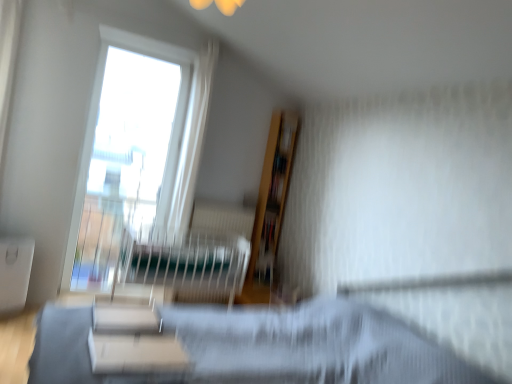
The width and height of the screenshot is (512, 384). I want to click on matte black hospital bed at center, so click(x=184, y=264).

Find the location of a particular element. The width and height of the screenshot is (512, 384). white matte table at lower center, placed as the first table when sorted from right to left is located at coordinates (136, 354).

I want to click on transparent glass window at upper left, so click(137, 150).

What are the coordinates of `white glossy bookshelf at center` in the screenshot? It's located at (124, 315).

This screenshot has width=512, height=384. I want to click on matte black hospital bed at center, so click(184, 264).

From the picture: Is white matte table at lower left, the 2th table positioned from the front, wider or thinner than transparent glass window at upper left?

Considering their sizes, white matte table at lower left, the 2th table positioned from the front, looks broader than transparent glass window at upper left.

Considering the sizes of objects white matte table at lower left, which ranks as the second table in right-to-left order, and transparent glass window at upper left in the image provided, who is bigger, white matte table at lower left, which ranks as the second table in right-to-left order, or transparent glass window at upper left?

transparent glass window at upper left is bigger.

Considering the positions of objects white matte table at lower left, positioned as the 1th table in back-to-front order, and transparent glass window at upper left in the image provided, who is more to the right, white matte table at lower left, positioned as the 1th table in back-to-front order, or transparent glass window at upper left?

transparent glass window at upper left is more to the right.

Is white matte table at lower left, positioned as the 1th table in back-to-front order, oriented towards transparent glass window at upper left?

No.

Is wooden bookshelf at upper center positioned with its back to white matte table at lower center, placed as the first table when sorted from right to left?

That's not correct — wooden bookshelf at upper center is not looking away from white matte table at lower center, placed as the first table when sorted from right to left.

In the image, is wooden bookshelf at upper center on the left side or the right side of white matte table at lower center, which is the 2th table in back-to-front order?

In the image, wooden bookshelf at upper center appears on the right side of white matte table at lower center, which is the 2th table in back-to-front order.

From a real-world perspective, count 1st tables downward from the wooden bookshelf at upper center and point to it. Please provide its 2D coordinates.

[(136, 354)]

Locate an element on the screen. The height and width of the screenshot is (384, 512). window that is on the left side of white glossy bookshelf at center is located at coordinates (137, 150).

Is transparent glass window at upper left further to camera compared to white glossy bookshelf at center?

Yes, it is.

Is transparent glass window at upper left facing towards white glossy bookshelf at center?

Yes, transparent glass window at upper left is turned towards white glossy bookshelf at center.

Would you say white matte table at lower left, positioned as the 1th table in back-to-front order, is part of matte black hospital bed at center's contents?

Definitely not — white matte table at lower left, positioned as the 1th table in back-to-front order, is not inside matte black hospital bed at center.

Is matte black hospital bed at center looking in the opposite direction of white matte table at lower left, positioned as the 1th table in back-to-front order?

No, white matte table at lower left, positioned as the 1th table in back-to-front order, is not at the back of matte black hospital bed at center.

Is matte black hospital bed at center with white matte table at lower left, positioned as the 1th table in back-to-front order?

No.

Locate an element on the screen. The height and width of the screenshot is (384, 512). book located above the white matte table at lower left, which is the first table in left-to-right order (from the image's perspective) is located at coordinates (269, 233).

From the image's perspective, between white matte table at lower left, which is the first table in left-to-right order, and wooden bookshelf at upper center, who is located below?

white matte table at lower left, which is the first table in left-to-right order.

Considering the positions of points (144, 192) and (126, 260), is point (144, 192) farther from camera compared to point (126, 260)?

Yes, it is behind point (126, 260).

In the scene shown: Is transparent glass window at upper left inside or outside of matte black hospital bed at center?

transparent glass window at upper left is outside matte black hospital bed at center.

Considering the sizes of objects transparent glass window at upper left and matte black hospital bed at center in the image provided, who is shorter, transparent glass window at upper left or matte black hospital bed at center?

Standing shorter between the two is matte black hospital bed at center.

From the image's perspective, is matte black hospital bed at center located above or below transparent glass window at upper left?

From the image's perspective, matte black hospital bed at center appears below transparent glass window at upper left.

Can you confirm if matte black hospital bed at center is positioned to the left of transparent glass window at upper left?

No, matte black hospital bed at center is not to the left of transparent glass window at upper left.

Is point (168, 250) closer or farther from the camera than point (182, 144)?

Point (168, 250) is positioned closer to the camera compared to point (182, 144).

Is matte black hospital bed at center inside the boundaries of transparent glass window at upper left, or outside?

The correct answer is: outside.

This screenshot has width=512, height=384. I want to click on window on the right of white matte table at lower left, the 2th table positioned from the front, so click(137, 150).

Find the location of `book behind the white matte table at lower center, which is the 2th table in back-to-front order`. book behind the white matte table at lower center, which is the 2th table in back-to-front order is located at coordinates (269, 233).

Which object lies nearer to the anchor point transparent glass window at upper left, white matte table at lower left, positioned as the 1th table in back-to-front order, or matte black hospital bed at center?

matte black hospital bed at center.

From the image, which object appears to be nearer to wooden bookshelf at upper center, white matte table at lower left, which is the first table in left-to-right order, or transparent glass window at upper left?

Based on the image, transparent glass window at upper left appears to be nearer to wooden bookshelf at upper center.

Considering their positions, is matte black hospital bed at center positioned closer to white matte table at lower left, the 2th table positioned from the front, than white matte table at lower center, placed as the first table when sorted from right to left?

The object closer to white matte table at lower left, the 2th table positioned from the front, is matte black hospital bed at center.

When comparing their distances from wooden bookshelf at upper center, does white matte table at lower center, which is counted as the 2th table, starting from the left, or matte black hospital bed at center seem further?

white matte table at lower center, which is counted as the 2th table, starting from the left, lies further to wooden bookshelf at upper center than the other object.

When comparing their distances from transparent glass window at upper left, does white glossy bookshelf at center or white matte table at lower center, which is the 2th table in back-to-front order, seem closer?

white glossy bookshelf at center is closer to transparent glass window at upper left.

Based on their spatial positions, is white glossy bookshelf at center or white matte table at lower center, which is the 2th table in back-to-front order, closer to wooden bookshelf at upper center?

white glossy bookshelf at center is positioned closer to the anchor wooden bookshelf at upper center.

From the image, which object appears to be nearer to wooden bookshelf at upper center, matte black hospital bed at center or white glossy bookshelf at center?

The object closer to wooden bookshelf at upper center is matte black hospital bed at center.

Which object lies nearer to the anchor point transparent glass window at upper left, white glossy bookshelf at center or matte black hospital bed at center?

matte black hospital bed at center lies closer to transparent glass window at upper left than the other object.

Locate an element on the screen. hospital bed situated between transparent glass window at upper left and wooden bookshelf at upper center from left to right is located at coordinates (184, 264).

Identify the location of table positioned between white glossy bookshelf at center and transparent glass window at upper left from near to far. (15, 272).

Locate an element on the screen. This screenshot has height=384, width=512. furniture between white matte table at lower left, positioned as the 1th table in back-to-front order, and white matte table at lower center, which is the 2th table in back-to-front order, in the horizontal direction is located at coordinates (124, 315).

Locate an element on the screen. The image size is (512, 384). furniture between white matte table at lower left, the 2th table positioned from the front, and matte black hospital bed at center from left to right is located at coordinates (124, 315).